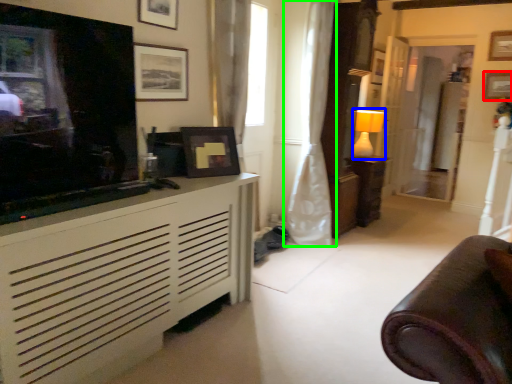
Question: Which is nearer to the picture frame (highlighted by a red box)? lamp (highlighted by a blue box) or curtain (highlighted by a green box).

Choices:
 (A) lamp
 (B) curtain

Answer: (A)